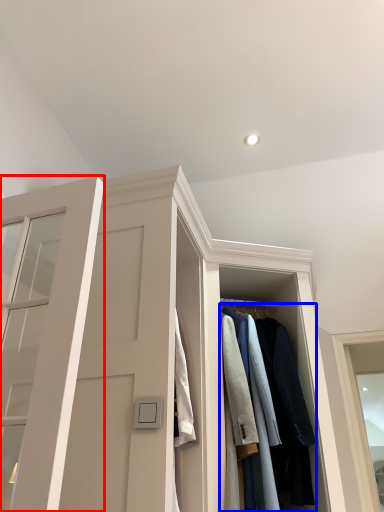
Question: Which point is closer to the camera, door (highlighted by a red box) or clothing (highlighted by a blue box)?

Choices:
 (A) door
 (B) clothing

Answer: (A)